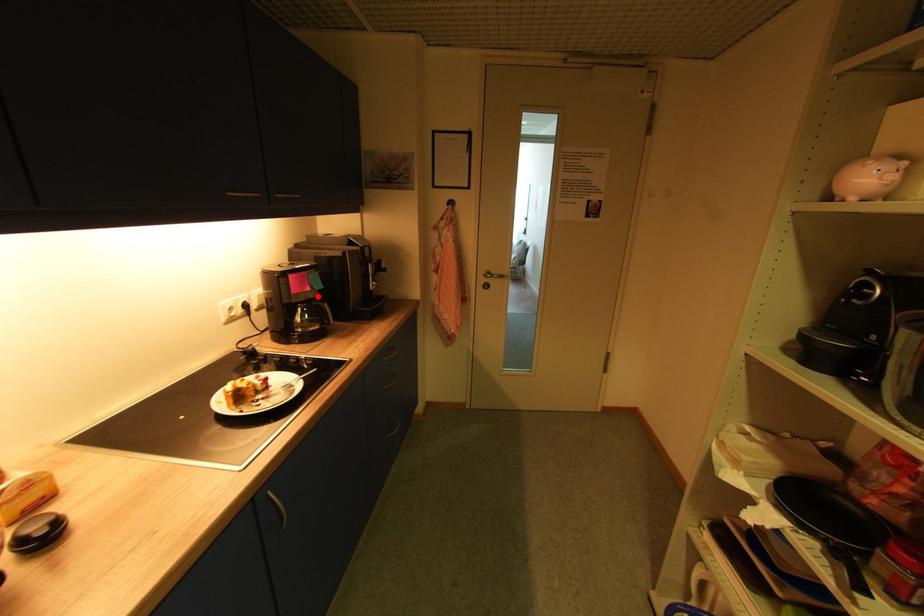
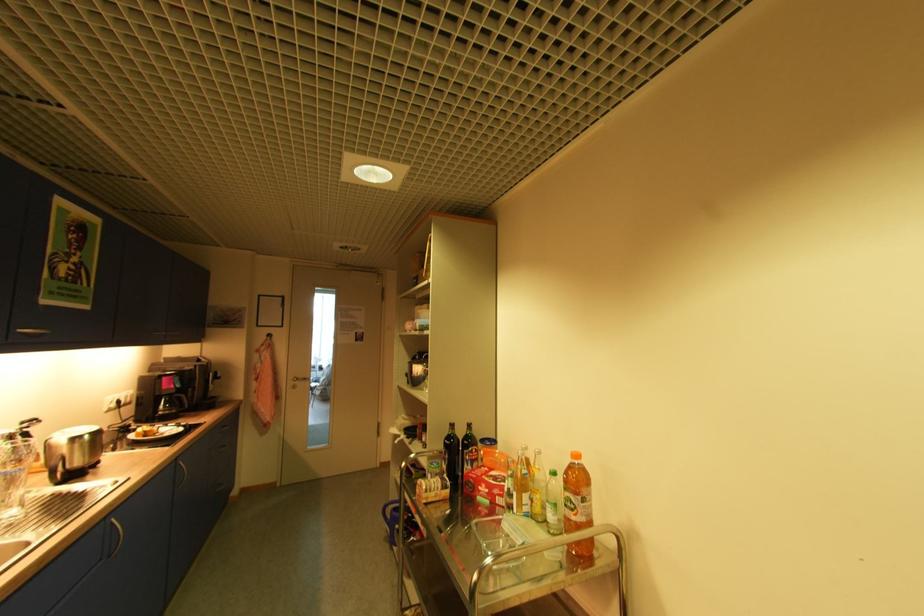
Find the pixel in the second image that matches the highlighted location in the first image.

(178, 392)